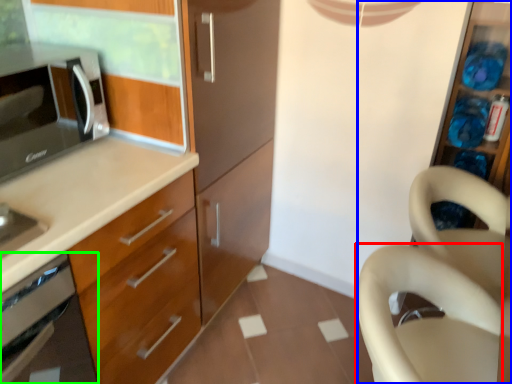
Question: Which object is positioned closest to swivel chair (highlighted by a red box)? Select from dresser (highlighted by a blue box) and oven (highlighted by a green box).

Choices:
 (A) dresser
 (B) oven

Answer: (A)